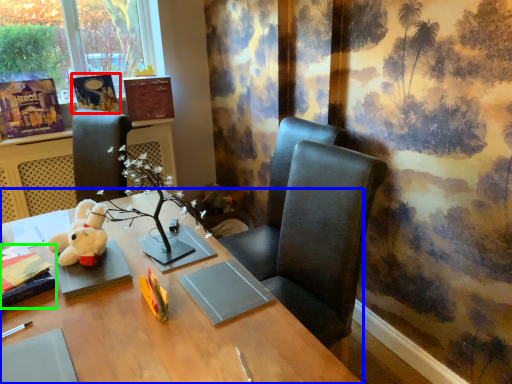
Question: Which is farther away from book (highlighted by a red box)? desk (highlighted by a blue box) or book (highlighted by a green box)?

Choices:
 (A) desk
 (B) book

Answer: (A)